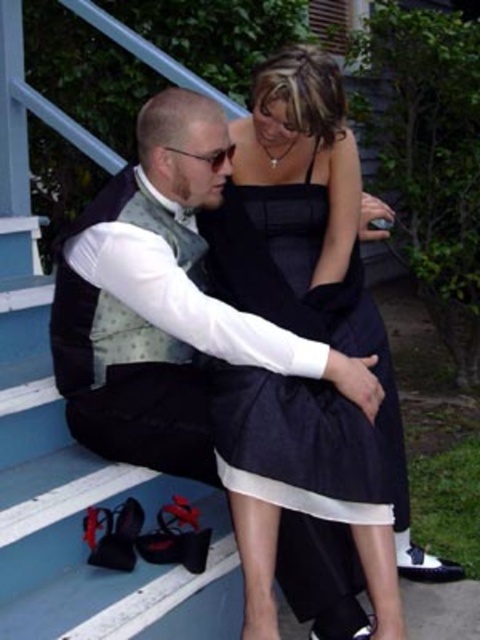
Question: Considering the relative positions of satin black dress at center and black leather shoe at lower right in the image provided, where is satin black dress at center located with respect to black leather shoe at lower right?

Choices:
 (A) left
 (B) right

Answer: (A)

Question: Which point is farther from the camera taking this photo?

Choices:
 (A) click(x=354, y=333)
 (B) click(x=312, y=630)
 (C) click(x=451, y=576)

Answer: (C)

Question: Which object is positioned farthest from the black leather shoe at lower right?

Choices:
 (A) satin black dress at center
 (B) white leather shoe at lower right
 (C) black satin vest at center

Answer: (C)

Question: Is black satin vest at center bigger than white leather shoe at lower right?

Choices:
 (A) yes
 (B) no

Answer: (A)

Question: Observing the image, what is the correct spatial positioning of satin black dress at center in reference to black leather shoe at lower right?

Choices:
 (A) above
 (B) below

Answer: (A)

Question: Which point is farther to the camera?

Choices:
 (A) black leather shoe at lower right
 (B) satin black dress at center
 (C) white leather shoe at lower right

Answer: (C)